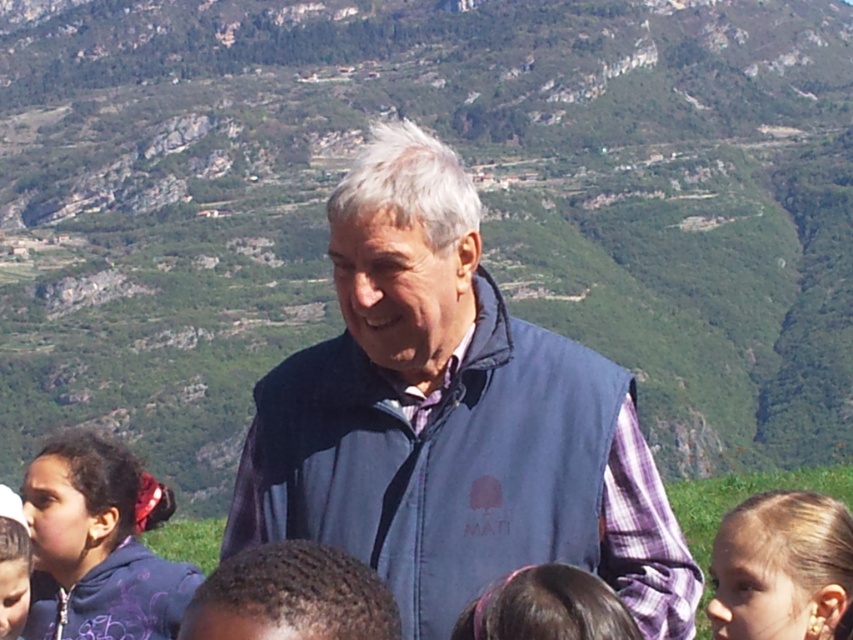
You are a photographer trying to capture a photo of the dark brown hair at center and the matte purple hoodie at lower left. Based on their heights, which object should you focus on first if you want to ensure both are in the frame without adjusting your camera angle?

The dark brown hair at center is taller than the matte purple hoodie at lower left, so you should focus on the dark brown hair at center first to ensure both are in the frame without adjusting your camera angle.

You are a photographer setting up a tripod to capture the scenic mountain view. You notice two hoodies, the dark blue hoodie at lower left and the matte purple hoodie at lower left. Which hoodie should you place your tripod behind to ensure it doesn t block the mountain view?

The dark blue hoodie at lower left has a larger size compared to matte purple hoodie at lower left. Placing the tripod behind the larger dark blue hoodie at lower left would provide more coverage and ensure the mountain view remains unobstructed.

You are a photographer trying to capture a wide shot of the scene. You notice the dark brown hair at center and the matte purple hoodie at lower left. Which object should you focus on first if you want to ensure both are in frame without moving the camera?

You should focus on the dark brown hair at center first because it is wider than the matte purple hoodie at lower left, so centering it will help keep both in frame.